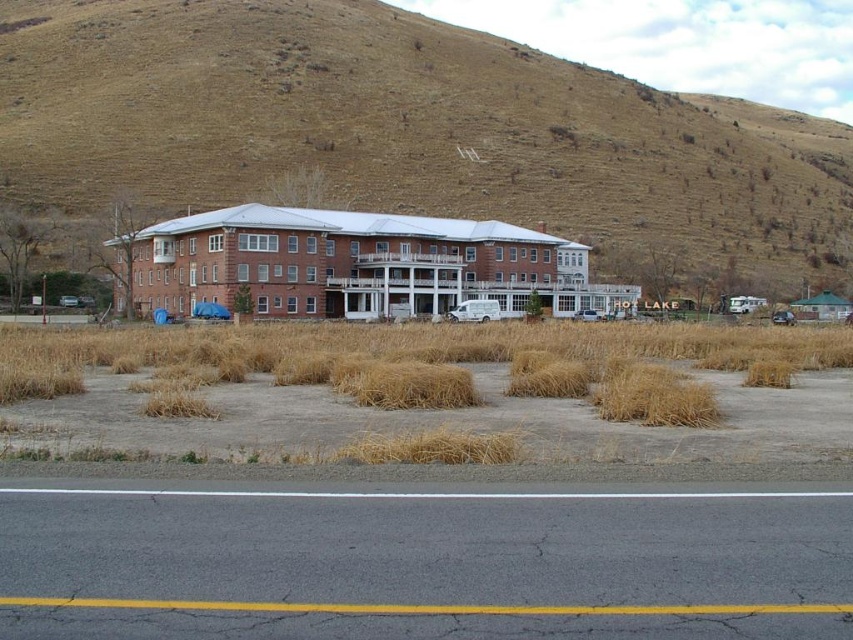
Question: Which object is closer to the camera taking this photo?

Choices:
 (A) dry straw at lower center
 (B) brown grassy hillside at upper center

Answer: (A)

Question: From the image, what is the correct spatial relationship of brown grassy hillside at upper center in relation to dry straw at lower center?

Choices:
 (A) below
 (B) above

Answer: (B)

Question: Does brown grassy hillside at upper center have a larger size compared to dry straw at lower center?

Choices:
 (A) yes
 (B) no

Answer: (A)

Question: Can you confirm if brown grassy hillside at upper center is thinner than dry straw at lower center?

Choices:
 (A) no
 (B) yes

Answer: (A)

Question: Which point is farther from the camera taking this photo?

Choices:
 (A) (448, 372)
 (B) (41, 1)

Answer: (B)

Question: Which point appears closest to the camera in this image?

Choices:
 (A) (30, 124)
 (B) (27, 364)

Answer: (B)